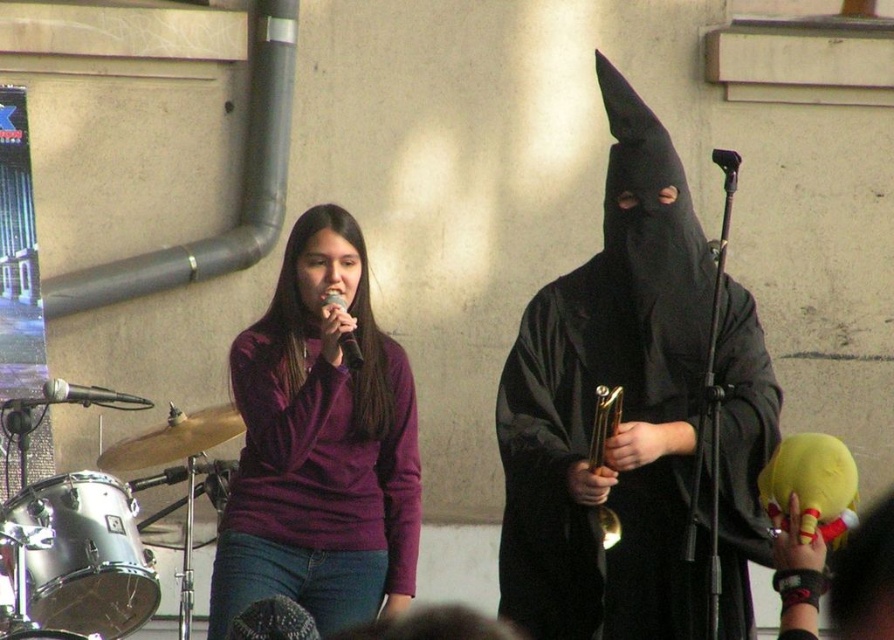
Question: Is black matte cloak at center smaller than matte black microphone at center?

Choices:
 (A) no
 (B) yes

Answer: (A)

Question: Can you confirm if black matte cloak at center is positioned to the right of brushed metal drum at lower left?

Choices:
 (A) yes
 (B) no

Answer: (A)

Question: Is black matte cloak at center positioned at the back of brushed metal drum at lower left?

Choices:
 (A) no
 (B) yes

Answer: (A)

Question: Which object appears farthest from the camera in this image?

Choices:
 (A) black matte cloak at center
 (B) gold shiny trumpet at center
 (C) purple velvet shirt at center
 (D) brushed metal drum at lower left

Answer: (D)

Question: Among these objects, which one is nearest to the camera?

Choices:
 (A) brushed metal drum at lower left
 (B) metallic silver microphone at left

Answer: (A)

Question: Which object appears closest to the camera in this image?

Choices:
 (A) metallic silver microphone at left
 (B) gold shiny trumpet at center
 (C) black matte cloak at center

Answer: (B)